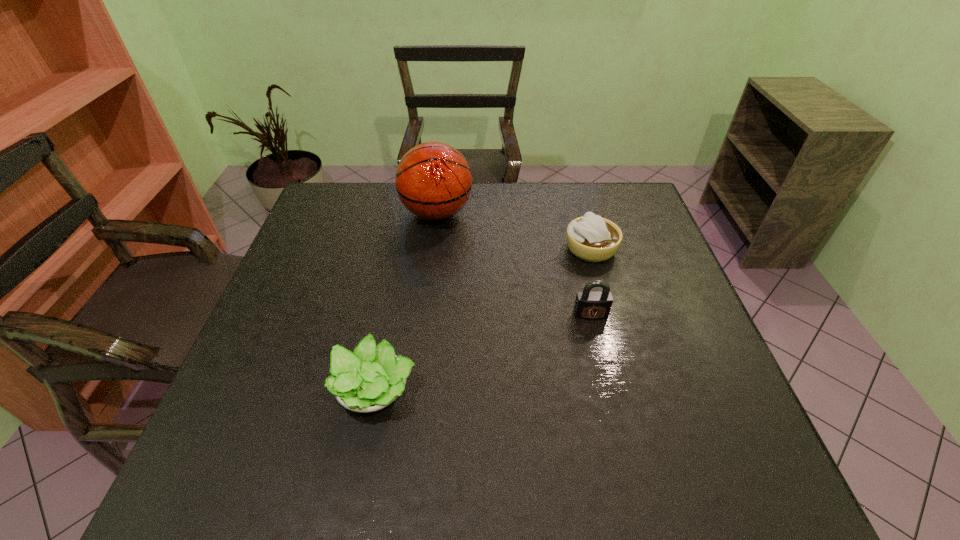
You are a GUI agent. You are given a task and a screenshot of the screen. Output one action in this format:
    pyautogui.click(x=<x>, y=<y>)
    Task: Click on the object situated at the right edge
    Image resolution: width=960 pixels, height=540 pixels.
    Given the screenshot: What is the action you would take?
    pyautogui.click(x=591, y=238)

This screenshot has height=540, width=960. Identify the location of free point at the far edge. (572, 193).

The height and width of the screenshot is (540, 960). In the image, there is a desktop. In order to click on vacant space at the near edge in this screenshot , I will do `click(328, 477)`.

Locate an element on the screen. vacant space at the right edge of the desktop is located at coordinates (676, 335).

The width and height of the screenshot is (960, 540). Identify the location of vacant space at the far left corner of the desktop. (348, 197).

This screenshot has width=960, height=540. In the image, there is a desktop. Find the location of `free region at the near left corner`. free region at the near left corner is located at coordinates (273, 472).

This screenshot has height=540, width=960. I want to click on vacant space at the far right corner, so click(x=614, y=210).

Identify the location of vacant space at the near right corner of the desktop. The width and height of the screenshot is (960, 540). (756, 484).

Where is `free space between the padlock and the basketball`? The width and height of the screenshot is (960, 540). free space between the padlock and the basketball is located at coordinates (514, 264).

I want to click on free space between the nearest object and the padlock, so click(x=483, y=352).